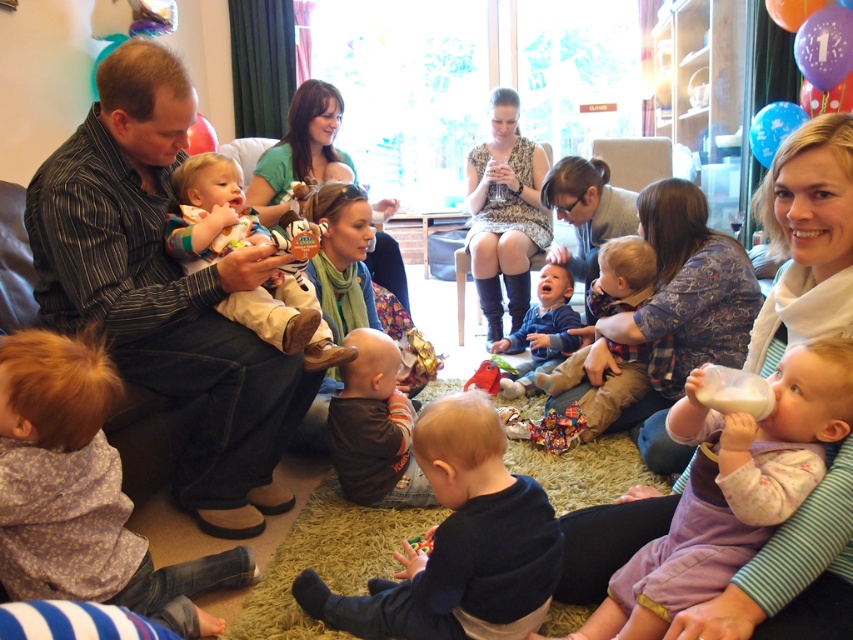
Does printed fabric dress at center have a greater height compared to rubber duck at center?

Indeed, printed fabric dress at center has a greater height compared to rubber duck at center.

How distant is printed fabric dress at center from rubber duck at center?

The distance of printed fabric dress at center from rubber duck at center is 33.07 inches.

The width and height of the screenshot is (853, 640). I want to click on printed fabric dress at center, so click(503, 212).

You are a GUI agent. You are given a task and a screenshot of the screen. Output one action in this format:
    pyautogui.click(x=<x>, y=<y>)
    Task: Click on the printed fabric dress at center
    Image resolution: width=853 pixels, height=640 pixels.
    Given the screenshot: What is the action you would take?
    pyautogui.click(x=503, y=212)

Does dark blue fabric at center have a larger size compared to brown soft fabric baby at center?

Yes, dark blue fabric at center is bigger than brown soft fabric baby at center.

Does dark blue fabric at center appear under brown soft fabric baby at center?

Indeed, dark blue fabric at center is positioned under brown soft fabric baby at center.

Measure the distance between dark blue fabric at center and camera.

dark blue fabric at center is 1.38 meters away from camera.

I want to click on dark blue fabric at center, so click(x=459, y=541).

The image size is (853, 640). In order to click on soft beige plush toy at center in this screenshot , I will do `click(251, 244)`.

Is the position of soft beige plush toy at center less distant than that of rubber duck at center?

Yes, it is.

You are a GUI agent. You are given a task and a screenshot of the screen. Output one action in this format:
    pyautogui.click(x=<x>, y=<y>)
    Task: Click on the soft beige plush toy at center
    This screenshot has height=640, width=853.
    Given the screenshot: What is the action you would take?
    pyautogui.click(x=251, y=244)